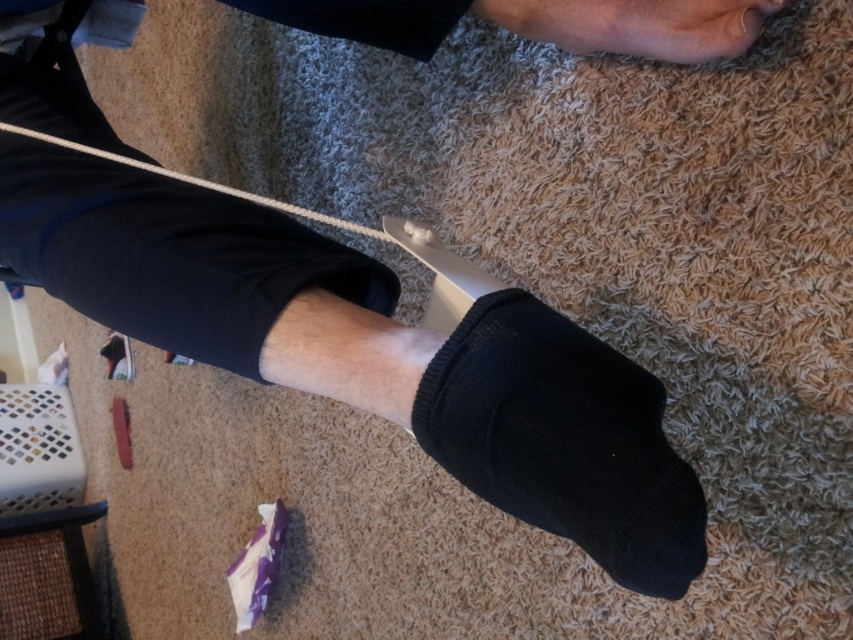
You are a photographer setting up a shoot in this scene. You need to place a small prop between the black knitted sock at lower center and the matte black foot at upper right. Based on their positions, which side of the sock should you place it to ensure it stays closer to the foot?

You should place the prop to the right side of the black knitted sock at lower center. Since the sock is to the left of the matte black foot at upper right, placing the prop to the sock s right side will position it closer to the foot.

You are organizing a small toy car that is 5 cm long. You want to place it either on the black knitted sock at lower center or the white string at center. Which object can fit the toy car better?

The white string at center can fit the toy car better because the black knitted sock at lower center occupies less space than the white string at center, meaning the white string has more space available.